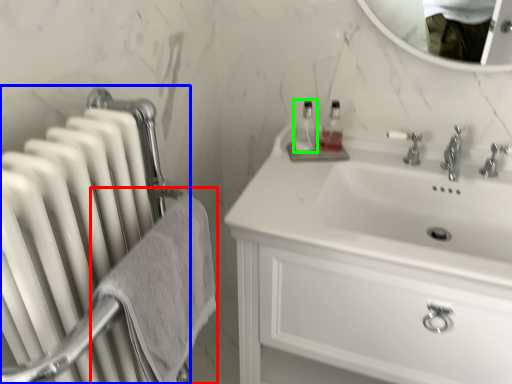
Question: Estimate the real-world distances between objects in this image. Which object is farther from bath towel (highlighted by a red box), radiator (highlighted by a blue box) or bottle (highlighted by a green box)?

Choices:
 (A) radiator
 (B) bottle

Answer: (B)